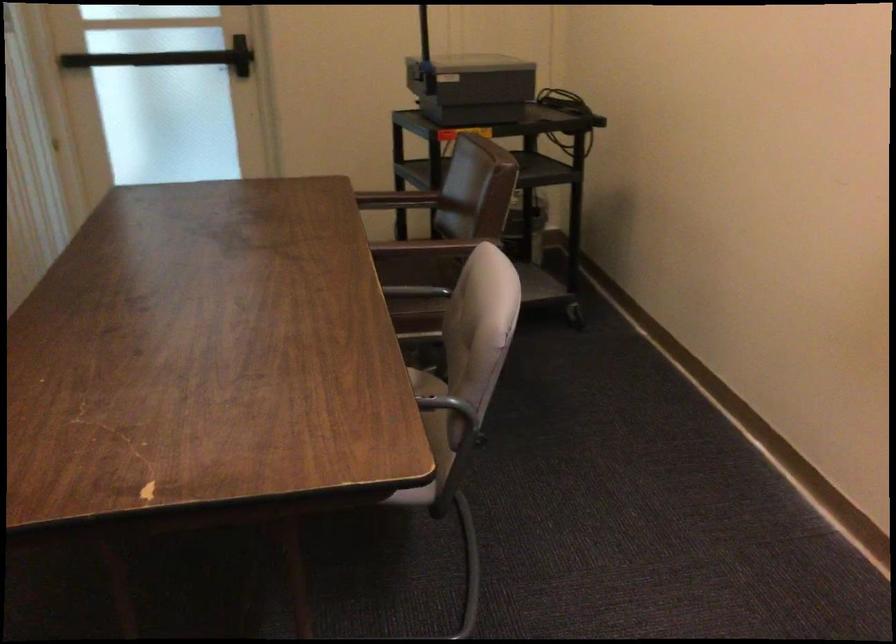
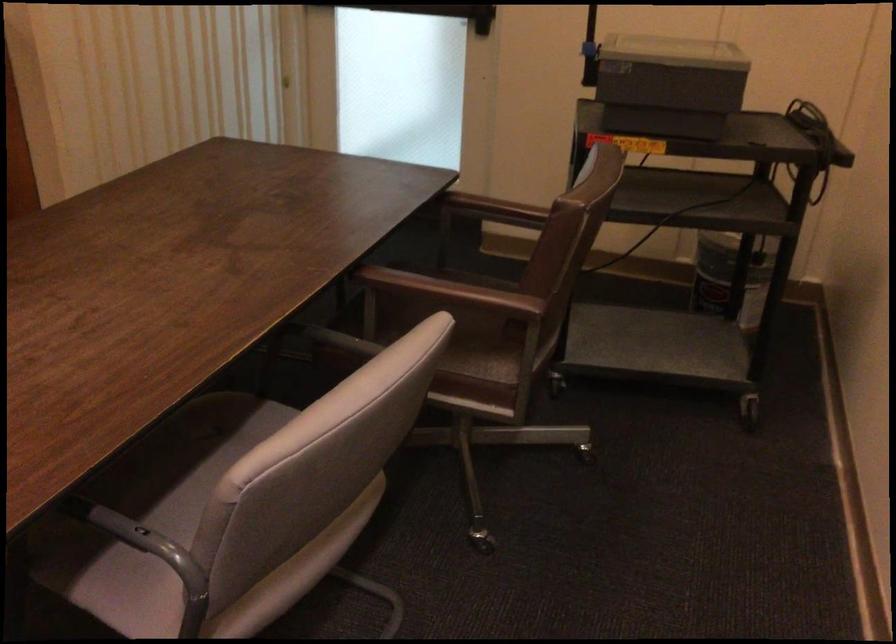
Question: Based on the continuous images, in which direction is the camera rotating? Reply with the corresponding letter.

Choices:
 (A) Left
 (B) Right
 (C) Up
 (D) Down

Answer: (A)